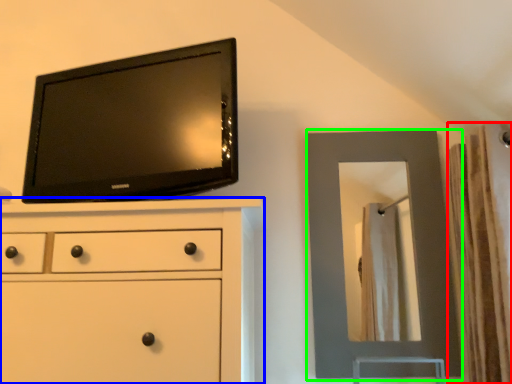
Question: Estimate the real-world distances between objects in this image. Which object is closer to curtain (highlighted by a red box), chest of drawers (highlighted by a blue box) or mirror (highlighted by a green box)?

Choices:
 (A) chest of drawers
 (B) mirror

Answer: (B)